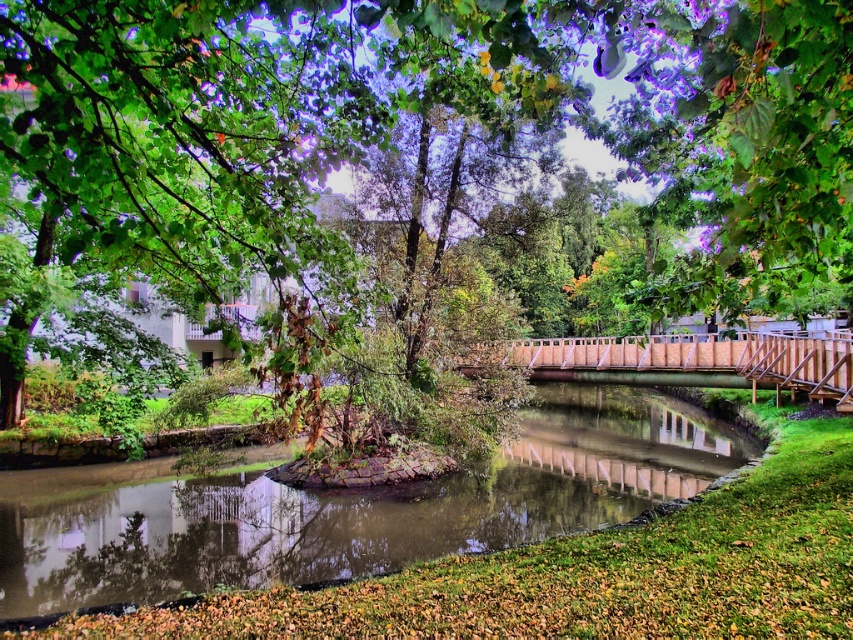
Question: Which point appears farthest from the camera in this image?

Choices:
 (A) (766, 179)
 (B) (119, 516)
 (C) (753, 356)

Answer: (C)

Question: Which object is the closest to the greenish murky water at center?

Choices:
 (A) green leafy tree at center
 (B) wooden bridge at center

Answer: (B)

Question: Does greenish murky water at center appear on the right side of wooden bridge at center?

Choices:
 (A) yes
 (B) no

Answer: (B)

Question: Considering the real-world distances, which object is closest to the wooden bridge at center?

Choices:
 (A) green leafy tree at center
 (B) greenish murky water at center

Answer: (B)

Question: Does greenish murky water at center have a smaller size compared to wooden bridge at center?

Choices:
 (A) yes
 (B) no

Answer: (A)

Question: Can you confirm if green leafy tree at center is smaller than wooden bridge at center?

Choices:
 (A) yes
 (B) no

Answer: (B)